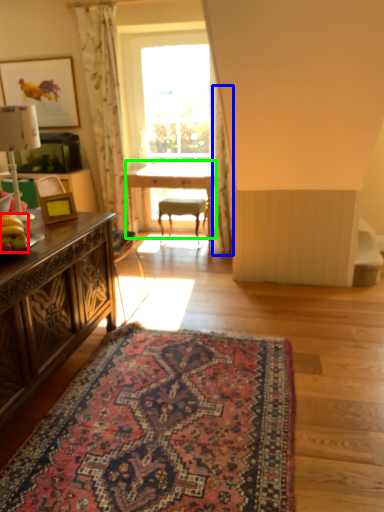
Question: Which object is the farthest from banana (highlighted by a red box)? Choose among these: curtain (highlighted by a blue box) or table (highlighted by a green box).

Choices:
 (A) curtain
 (B) table

Answer: (B)